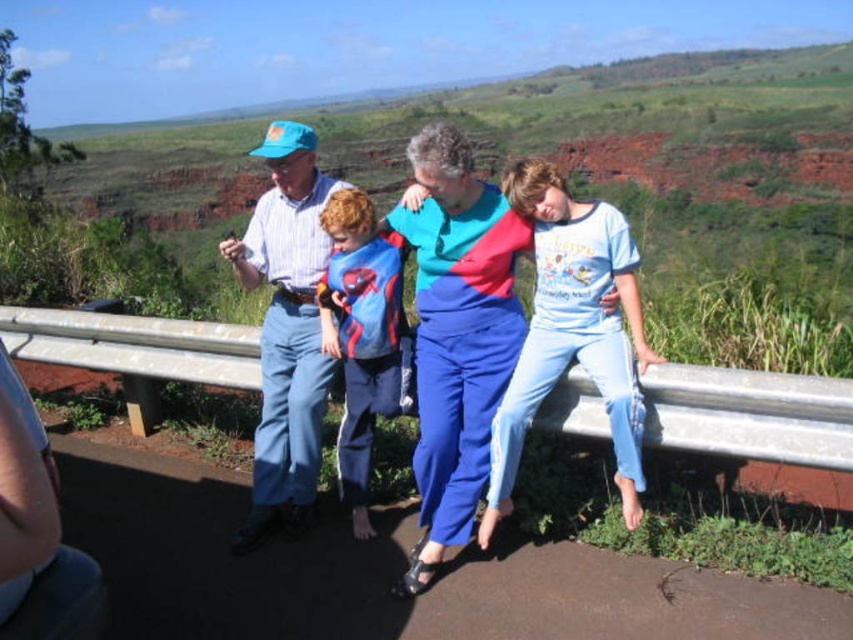
Question: Estimate the real-world distances between objects in this image. Which object is farther from the silver metallic rail at center?

Choices:
 (A) green grassy hillside at upper center
 (B) blue satin blouse at center

Answer: (A)

Question: Is green grassy hillside at upper center above silver metallic rail at center?

Choices:
 (A) no
 (B) yes

Answer: (B)

Question: From the image, what is the correct spatial relationship of green grassy hillside at upper center in relation to silver metallic rail at center?

Choices:
 (A) above
 (B) below

Answer: (A)

Question: Which object is farther from the camera taking this photo?

Choices:
 (A) blue satin blouse at center
 (B) light blue cotton shirt at center
 (C) silver metallic rail at center
 (D) green grassy hillside at upper center

Answer: (D)

Question: Can you confirm if blue cotton pants at center is smaller than silver metallic rail at center?

Choices:
 (A) yes
 (B) no

Answer: (A)

Question: Which object is the closest to the green grassy hillside at upper center?

Choices:
 (A) silver metallic rail at center
 (B) blue cotton pants at center
 (C) light blue cotton shirt at center
 (D) blue satin blouse at center

Answer: (A)